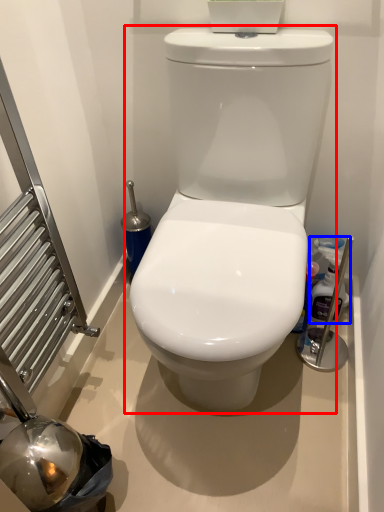
Question: Which point is further to the camera, toilet (highlighted by a red box) or cleaning product (highlighted by a blue box)?

Choices:
 (A) toilet
 (B) cleaning product

Answer: (B)